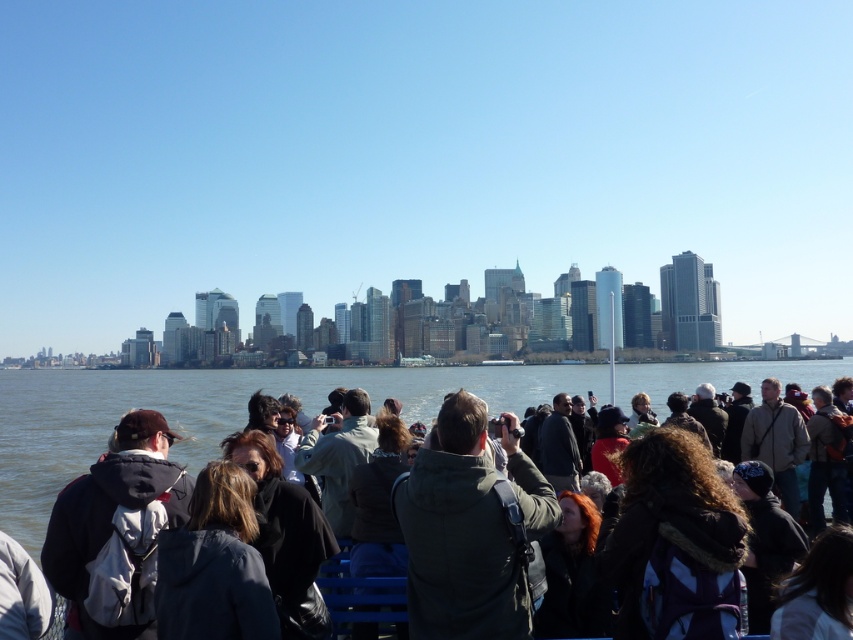
Does curly hair at center appear on the left side of dark brown hair at lower right?

Yes, curly hair at center is to the left of dark brown hair at lower right.

Who is positioned more to the left, curly hair at center or dark brown hair at lower right?

Positioned to the left is curly hair at center.

Does point (703, 588) come behind point (834, 556)?

No, (703, 588) is closer to viewer.

Locate an element on the screen. The height and width of the screenshot is (640, 853). curly hair at center is located at coordinates pos(672,538).

Does dark gray hoodie at left have a greater height compared to dark red hair at center?

Yes, dark gray hoodie at left is taller than dark red hair at center.

Can you confirm if dark gray hoodie at left is positioned to the right of dark red hair at center?

No, dark gray hoodie at left is not to the right of dark red hair at center.

Who is more distant from viewer, (80, 557) or (550, 596)?

Point (80, 557)

Find the location of `dark gray hoodie at left`. dark gray hoodie at left is located at coordinates (115, 525).

Is dark green jacket at center shorter than dark red hair at center?

In fact, dark green jacket at center may be taller than dark red hair at center.

Is point (439, 499) behind point (543, 600)?

No, (439, 499) is closer to viewer.

The image size is (853, 640). What do you see at coordinates (469, 529) in the screenshot?
I see `dark green jacket at center` at bounding box center [469, 529].

Locate an element on the screen. The height and width of the screenshot is (640, 853). dark green jacket at center is located at coordinates (469, 529).